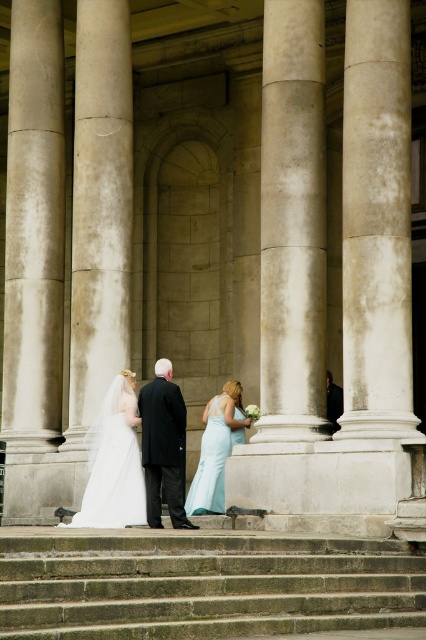
Does stone steps at center come in front of white marble column at right?

Yes.

The height and width of the screenshot is (640, 426). What do you see at coordinates (203, 586) in the screenshot?
I see `stone steps at center` at bounding box center [203, 586].

Who is more forward, [77,532] or [367,301]?

Positioned in front is point [77,532].

Find the location of a particular element. The image size is (426, 640). stone steps at center is located at coordinates (203, 586).

Does stone steps at center have a lesser height compared to white satin dress at center?

Yes, stone steps at center is shorter than white satin dress at center.

Is point (301, 556) positioned behind point (143, 481)?

No.

Is point (331, 618) farther from viewer compared to point (109, 422)?

That is False.

The width and height of the screenshot is (426, 640). I want to click on stone steps at center, so click(x=203, y=586).

Which is more to the right, white marble column at left or dark gray suit at center?

dark gray suit at center

Is the position of white marble column at left more distant than that of dark gray suit at center?

Yes, it is behind dark gray suit at center.

Locate an element on the screen. This screenshot has width=426, height=640. white marble column at left is located at coordinates (34, 228).

Image resolution: width=426 pixels, height=640 pixels. In order to click on white marble column at left in this screenshot , I will do `click(34, 228)`.